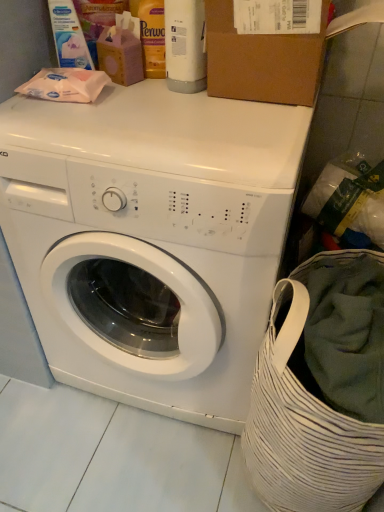
The width and height of the screenshot is (384, 512). Find the location of `free space above white matte washing machine at center (from a real-world perspective)`. free space above white matte washing machine at center (from a real-world perspective) is located at coordinates (168, 110).